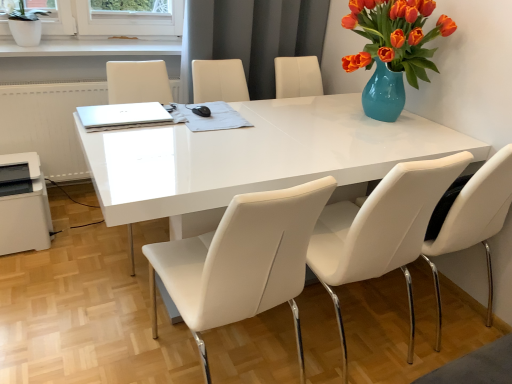
Image resolution: width=512 pixels, height=384 pixels. Find the location of `vacant space in front of white leather chair at center`. vacant space in front of white leather chair at center is located at coordinates (101, 296).